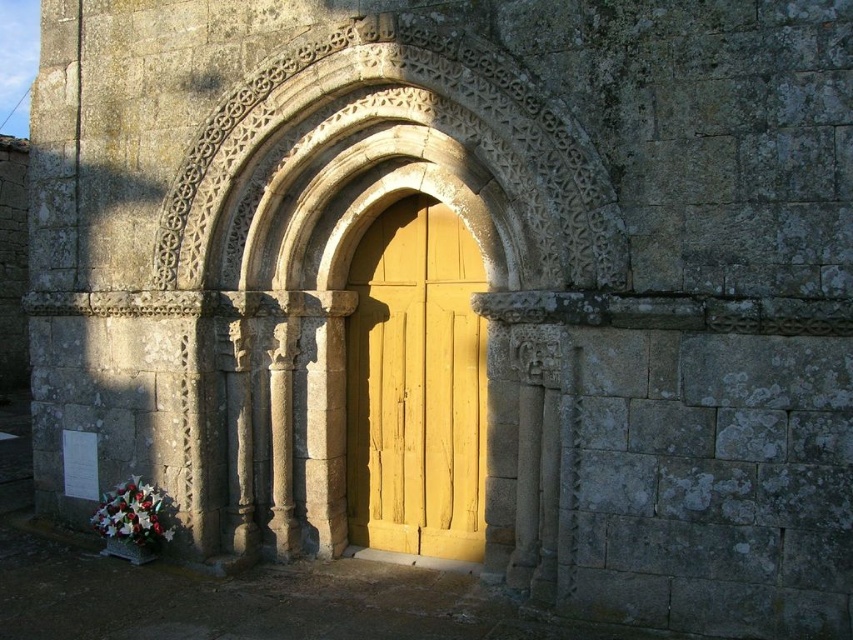
Question: Is carved stone archway at center positioned behind yellow wood door at center?

Choices:
 (A) no
 (B) yes

Answer: (A)

Question: Is carved stone archway at center thinner than yellow wood door at center?

Choices:
 (A) no
 (B) yes

Answer: (A)

Question: Does carved stone archway at center have a larger size compared to yellow wood door at center?

Choices:
 (A) no
 (B) yes

Answer: (B)

Question: Which point appears farthest from the camera in this image?

Choices:
 (A) (213, 161)
 (B) (434, 513)

Answer: (B)